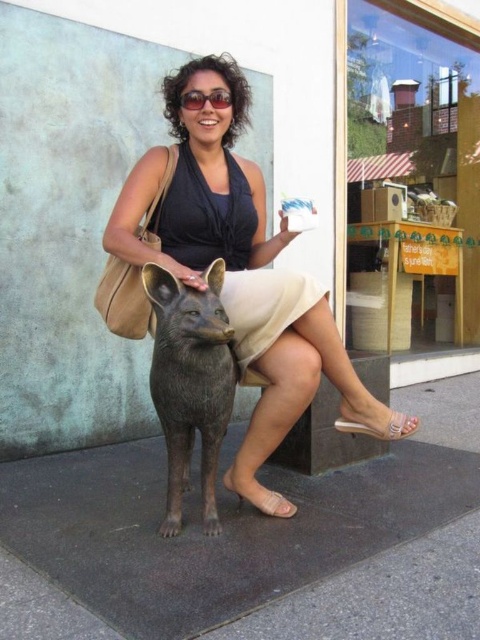
Does matte black dress at center lie in front of bronze statue at center?

That is False.

Image resolution: width=480 pixels, height=640 pixels. What do you see at coordinates (240, 269) in the screenshot? I see `matte black dress at center` at bounding box center [240, 269].

Which is behind, point (372, 413) or point (217, 436)?

Point (372, 413)

At what (x,y) coordinates should I click in order to perform the action: click on matte black dress at center. Please return your answer as a coordinate pair (x, y). This screenshot has width=480, height=640. Looking at the image, I should click on (240, 269).

Is point (230, 374) behind point (274, 282)?

No, (230, 374) is closer to viewer.

Which is above, bronze statue at center or beige satin dress at center?

Positioned higher is beige satin dress at center.

What are the coordinates of `bronze statue at center` in the screenshot? It's located at (190, 381).

Does matte black dress at center lie in front of beige satin dress at center?

Yes.

Does matte black dress at center have a greater width compared to beige satin dress at center?

Correct, the width of matte black dress at center exceeds that of beige satin dress at center.

Image resolution: width=480 pixels, height=640 pixels. In order to click on matte black dress at center in this screenshot , I will do `click(240, 269)`.